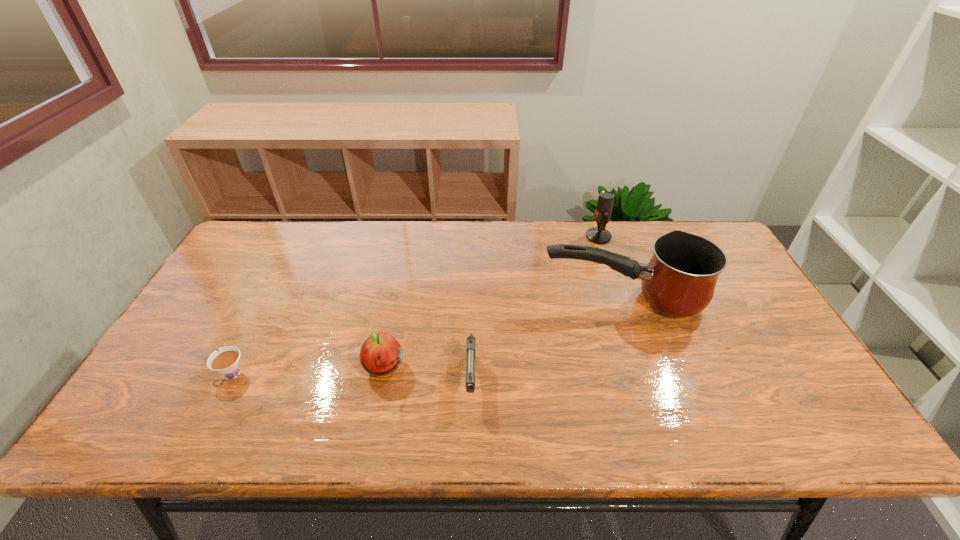
Image resolution: width=960 pixels, height=540 pixels. Find the location of `the tallest object`. the tallest object is located at coordinates (680, 279).

The width and height of the screenshot is (960, 540). I want to click on the second farthest object, so click(680, 279).

At what (x,y) coordinates should I click in order to perform the action: click on microphone. Please return your answer as a coordinate pair (x, y). Image resolution: width=960 pixels, height=540 pixels. Looking at the image, I should click on (599, 235).

I want to click on the fourth shortest object, so click(599, 235).

At what (x,y) coordinates should I click in order to perform the action: click on apple. Please return your answer as a coordinate pair (x, y). Looking at the image, I should click on (380, 355).

This screenshot has height=540, width=960. In order to click on the third object from left to right in this screenshot , I will do `click(471, 341)`.

Identify the location of the shortest object. (226, 361).

Image resolution: width=960 pixels, height=540 pixels. I want to click on the leftmost object, so click(x=226, y=361).

At what (x,y) coordinates should I click in order to perform the action: click on vacant space located on the handle side of the tallest object. Please return your answer as a coordinate pair (x, y). Looking at the image, I should click on (430, 299).

Locate an element on the screen. The image size is (960, 540). vacant space located on the handle side of the tallest object is located at coordinates (409, 299).